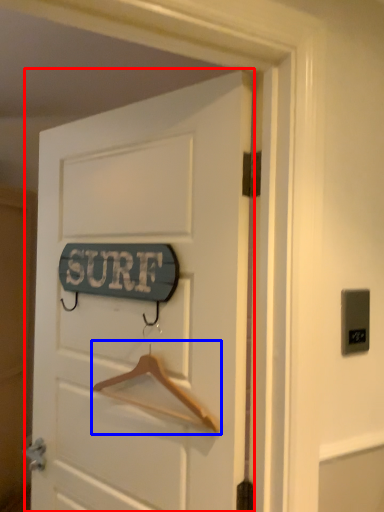
Question: Which of the following is the farthest to the observer, door (highlighted by a red box) or hanger (highlighted by a blue box)?

Choices:
 (A) door
 (B) hanger

Answer: (B)